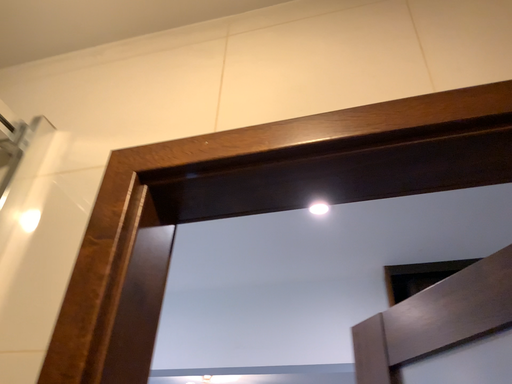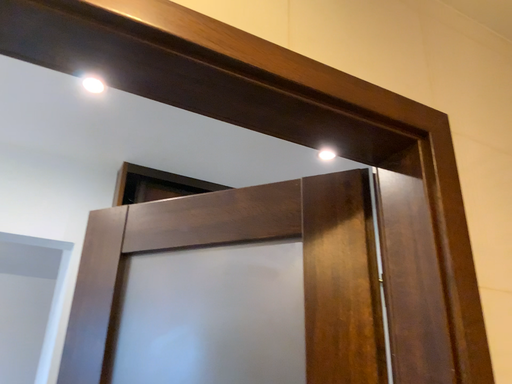
Question: How did the camera likely rotate when shooting the video?

Choices:
 (A) rotated downward
 (B) rotated upward

Answer: (A)